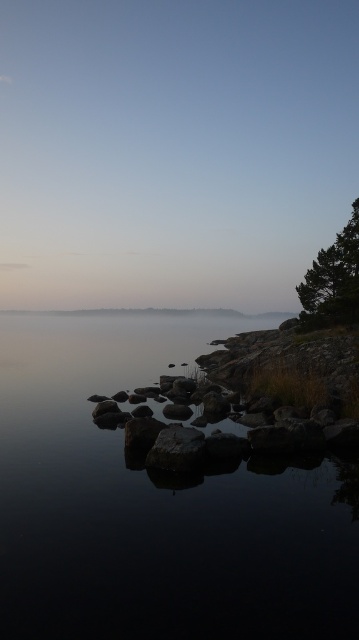
Does transparent water at center lie behind green textured tree at right?

No, it is in front of green textured tree at right.

Identify the location of transparent water at center. This screenshot has height=640, width=359. (154, 502).

Based on the photo, which is more to the right, green textured tree at right or smooth gray rock at center?

Positioned to the right is green textured tree at right.

Who is taller, green textured tree at right or smooth gray rock at center?

With more height is green textured tree at right.

Locate an element on the screen. This screenshot has height=640, width=359. green textured tree at right is located at coordinates (333, 280).

In the scene shown: Who is lower down, transparent water at center or smooth gray rock at center?

transparent water at center is lower down.

Between point (342, 516) and point (165, 436), which one is positioned behind?

The point (165, 436) is more distant.

Does point (244, 545) come farther from viewer compared to point (171, 424)?

No, (244, 545) is in front of (171, 424).

You are a GUI agent. You are given a task and a screenshot of the screen. Output one action in this format:
    pyautogui.click(x=<x>, y=<y>)
    Task: Click on the transparent water at center
    Image resolution: width=359 pixels, height=640 pixels.
    Given the screenshot: What is the action you would take?
    pyautogui.click(x=154, y=502)